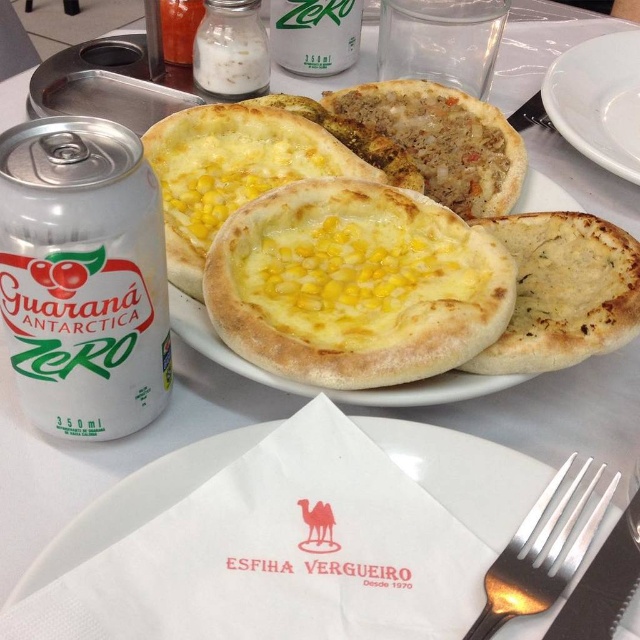
Is the position of white metallic can at left more distant than that of yellow cheesy pancake at center?

No, white metallic can at left is in front of yellow cheesy pancake at center.

The width and height of the screenshot is (640, 640). I want to click on white metallic can at left, so click(x=83, y=276).

Locate an element on the screen. This screenshot has height=640, width=640. white metallic can at left is located at coordinates (83, 276).

Which is in front, point (564, 465) or point (304, 10)?

Positioned in front is point (564, 465).

Measure the distance between point (548, 548) and camera.

Point (548, 548) is 11.65 inches away from camera.

The width and height of the screenshot is (640, 640). Find the location of `silver metallic fork at lower right`. silver metallic fork at lower right is located at coordinates (541, 550).

Is the position of yellow cheesy pancake at center more distant than that of white ceramic plate at upper right?

No, it is in front of white ceramic plate at upper right.

Can you confirm if yellow cheesy pancake at center is wider than white ceramic plate at upper right?

Incorrect, yellow cheesy pancake at center's width does not surpass white ceramic plate at upper right's.

You are a GUI agent. You are given a task and a screenshot of the screen. Output one action in this format:
    pyautogui.click(x=<x>, y=<y>)
    Task: Click on the yellow cheesy pancake at center
    
    Given the screenshot: What is the action you would take?
    pyautogui.click(x=563, y=291)

The width and height of the screenshot is (640, 640). What are the coordinates of `yellow cheesy pancake at center` in the screenshot? It's located at (563, 291).